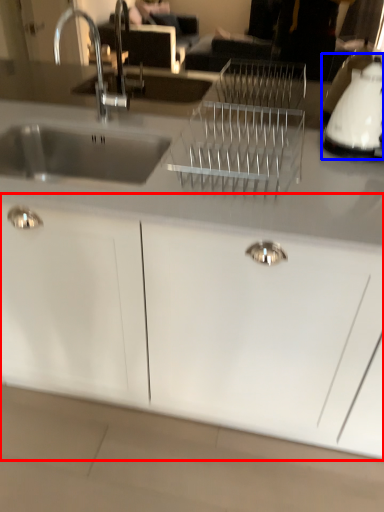
Question: Which of the following is the closest to the observer, cabinetry (highlighted by a red box) or appliance (highlighted by a blue box)?

Choices:
 (A) cabinetry
 (B) appliance

Answer: (A)